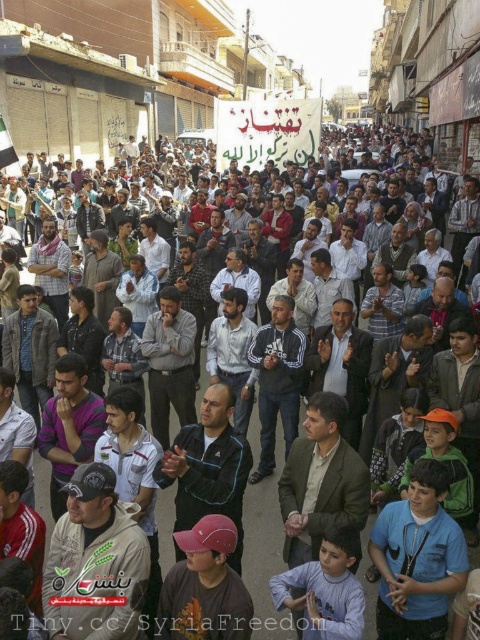
Does dark gray cap at center have a smaller size compared to blue fabric shirt at lower right?

Yes, dark gray cap at center is smaller than blue fabric shirt at lower right.

Based on the photo, between dark gray cap at center and blue fabric shirt at lower right, which one has less height?

With less height is dark gray cap at center.

Does point (119, 548) lie in front of point (447, 540)?

Yes.

The image size is (480, 640). What are the coordinates of `dark gray cap at center` in the screenshot? It's located at (96, 563).